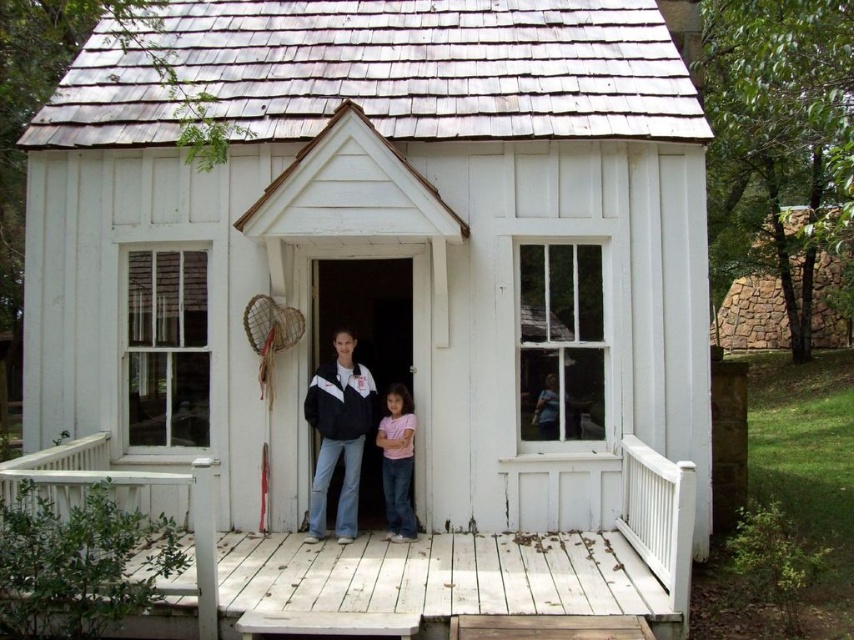
You are standing in front of the small white house and notice a specific point at coordinates (338, 433). Based on the scene description, can you determine what object this point is located on?

The point at coordinates (338, 433) is located on the matte black jacket at center.